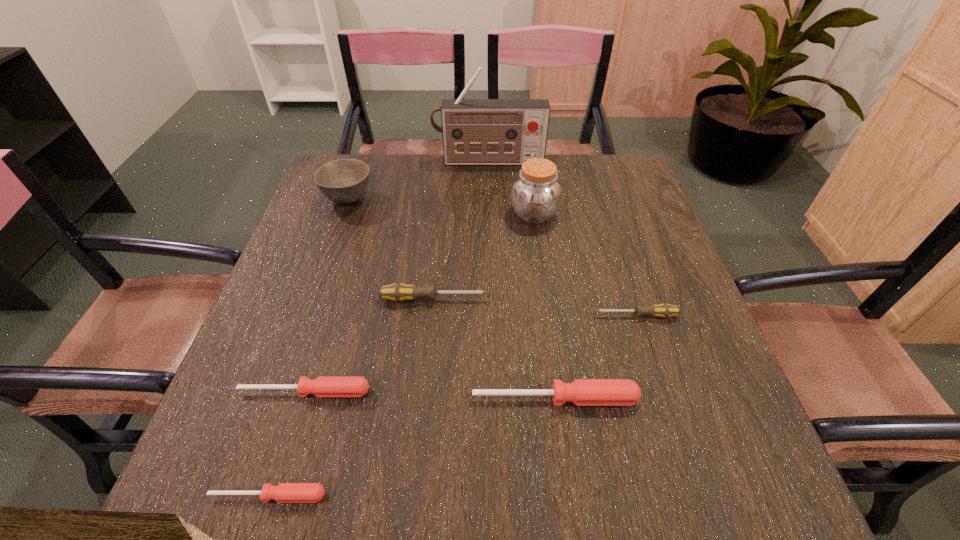
At what (x,y) coordinates should I click in order to perform the action: click on object that is positioned at the near left corner. Please return your answer as a coordinate pair (x, y). Looking at the image, I should click on (284, 492).

You are a GUI agent. You are given a task and a screenshot of the screen. Output one action in this format:
    pyautogui.click(x=<x>, y=<y>)
    Task: Click on the free space at the far edge of the desktop
    
    Given the screenshot: What is the action you would take?
    point(507,193)

Find the location of a particular element. free space at the near edge of the desktop is located at coordinates (327, 470).

Where is `blank space at the left edge`? The height and width of the screenshot is (540, 960). blank space at the left edge is located at coordinates (318, 288).

Locate an element on the screen. The width and height of the screenshot is (960, 540). vacant space at the right edge is located at coordinates (672, 354).

Where is `vacant space at the far left corner of the desktop`? The image size is (960, 540). vacant space at the far left corner of the desktop is located at coordinates (376, 171).

Find the location of `free space at the far right corner of the desktop`. free space at the far right corner of the desktop is located at coordinates (589, 195).

I want to click on free space between the radio receiver and the second smallest red screwdriver, so (396, 276).

The height and width of the screenshot is (540, 960). I want to click on vacant space that is in between the rightmost red screwdriver and the nearest red screwdriver, so click(412, 447).

Locate an element on the screen. This screenshot has height=540, width=960. empty space between the second biggest red screwdriver and the sixth shortest object is located at coordinates (326, 295).